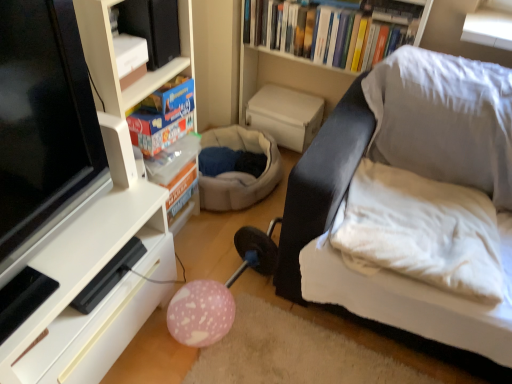
Question: From a real-world perspective, relative to blue cardboard box at upper left, which appears as the first book when viewed from the front, is white textured bookshelf at upper center vertically above or below?

Choices:
 (A) below
 (B) above

Answer: (A)

Question: Considering the positions of white textured bookshelf at upper center and blue cardboard box at upper left, marked as the 2th book in a top-to-bottom arrangement, in the image, is white textured bookshelf at upper center taller or shorter than blue cardboard box at upper left, marked as the 2th book in a top-to-bottom arrangement,?

Choices:
 (A) short
 (B) tall

Answer: (B)

Question: Which of these objects is positioned farthest from the pink matte balloon at lower center?

Choices:
 (A) blue cardboard box at upper left, the 2th book from the back
 (B) white textured bookshelf at upper center
 (C) white matte shelf at left, placed as the second shelf when sorted from bottom to top
 (D) black glossy tv at left
 (E) white glossy shelf at lower left, acting as the 2th shelf starting from the top

Answer: (B)

Question: Which of these objects is positioned farthest from the hardcover books at upper center, marked as the 1th book in a right-to-left arrangement?

Choices:
 (A) black leather couch at right
 (B) white soft pillow at right
 (C) blue cardboard box at upper left, marked as the 2th book in a top-to-bottom arrangement
 (D) white matte shelf at left, the 1th shelf when ordered from top to bottom
 (E) pink matte balloon at lower center

Answer: (E)